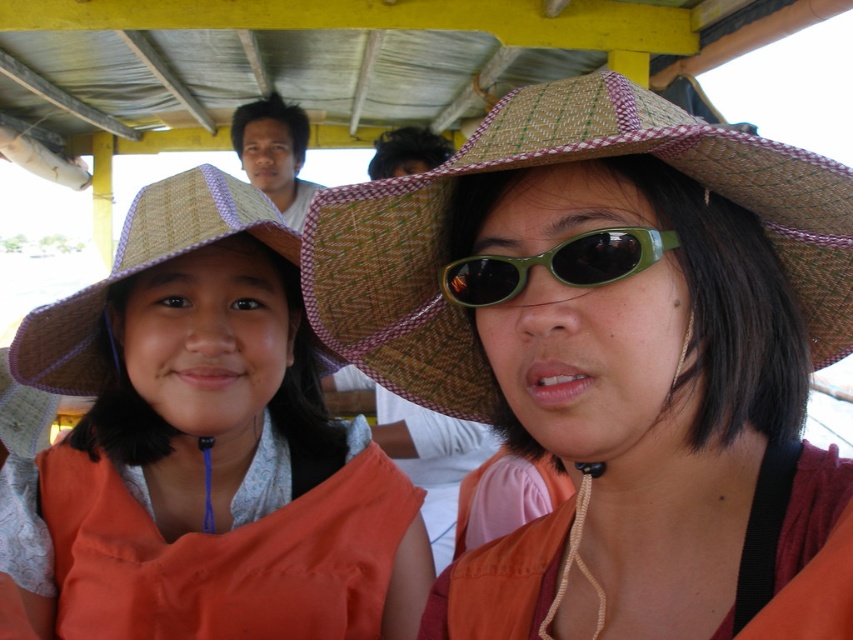
You are a photographer standing at a certain distance from the scene. You want to take a closeup shot of the brown woven straw hat at center. Considering your current position, can you estimate whether the hat is within your camera lens focal length of 20 inches?

The brown woven straw hat at center is 18.44 inches from the camera. Since the focal length of the camera lens is 20 inches, the hat is within the focal length range and can be captured clearly.

You are a photographer trying to capture both the brown woven straw hat at center and the woven straw hat at left in a single frame. Since the hats are overlapping, which hat is covering the other?

The brown woven straw hat at center is positioned over the woven straw hat at left, so it is covering the other hat.

You are standing in the scene and want to find the matte straw hat at center. According to the coordinates given, where should you look relative to the bottom left corner of the image?

The matte straw hat at center is located at coordinates 0.702 in the x direction and 0.239 in the y direction from the bottom left corner of the image.